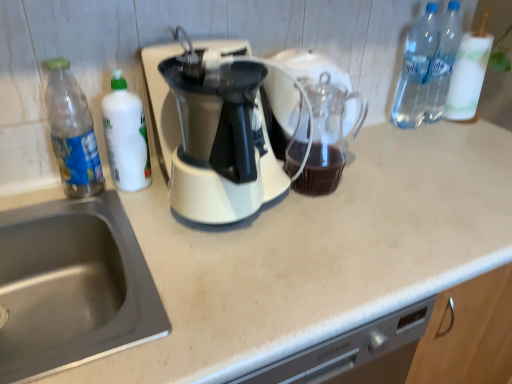
Describe the element at coordinates (319, 255) in the screenshot. The height and width of the screenshot is (384, 512). I see `beige laminate counter at center` at that location.

The image size is (512, 384). What are the coordinates of `white glossy bottle at left, positioned as the 2th bottle in left-to-right order` in the screenshot? It's located at [x=126, y=136].

Measure the distance between stainless steel sink at lower left and camera.

The distance of stainless steel sink at lower left from camera is 53.58 centimeters.

The image size is (512, 384). I want to click on transparent glass carafe at center, so click(279, 110).

In order to face transparent glass carafe at center, should I rotate leftwards or rightwards?

Turn right by 7.399 degrees to look at transparent glass carafe at center.

You are a GUI agent. You are given a task and a screenshot of the screen. Output one action in this format:
    pyautogui.click(x=<x>, y=<y>)
    Task: Click on the clear plastic bottle at upper right, the first bottle from the right
    Image resolution: width=512 pixels, height=384 pixels.
    Given the screenshot: What is the action you would take?
    pyautogui.click(x=468, y=74)

From a real-world perspective, who is located higher, white glossy bottle at left, positioned as the 2th bottle in left-to-right order, or clear plastic bottles at upper right, placed as the 2th bottle when sorted from right to left?

clear plastic bottles at upper right, placed as the 2th bottle when sorted from right to left, is physically above.

Can you confirm if white glossy bottle at left, positioned as the 2th bottle in left-to-right order, is smaller than clear plastic bottles at upper right, placed as the 2th bottle when sorted from right to left?

Yes, white glossy bottle at left, positioned as the 2th bottle in left-to-right order, is smaller than clear plastic bottles at upper right, placed as the 2th bottle when sorted from right to left.

Can we say white glossy bottle at left, positioned as the 2th bottle in left-to-right order, lies outside clear plastic bottles at upper right, placed as the 2th bottle when sorted from right to left?

white glossy bottle at left, positioned as the 2th bottle in left-to-right order, lies outside clear plastic bottles at upper right, placed as the 2th bottle when sorted from right to left,'s area.

Between white glossy bottle at left, which appears as the 3th bottle when viewed from the right, and clear plastic bottles at upper right, placed as the 2th bottle when sorted from right to left, which one appears on the left side from the viewer's perspective?

white glossy bottle at left, which appears as the 3th bottle when viewed from the right, is more to the left.

Where is `the 3rd bottle above when counting from the white glossy bottle at left, positioned as the 2th bottle in left-to-right order (from the image's perspective)`? This screenshot has width=512, height=384. the 3rd bottle above when counting from the white glossy bottle at left, positioned as the 2th bottle in left-to-right order (from the image's perspective) is located at coordinates (468, 74).

From the picture: From a real-world perspective, between white glossy bottle at left, which appears as the 3th bottle when viewed from the right, and clear plastic bottle at upper right, the 4th bottle when ordered from left to right, who is vertically lower?

white glossy bottle at left, which appears as the 3th bottle when viewed from the right, from a real-world perspective.

From the image's perspective, would you say white glossy bottle at left, which appears as the 3th bottle when viewed from the right, is positioned over clear plastic bottle at upper right, the 4th bottle when ordered from left to right?

Actually, white glossy bottle at left, which appears as the 3th bottle when viewed from the right, appears below clear plastic bottle at upper right, the 4th bottle when ordered from left to right, in the image.

From a real-world perspective, which is physically above, clear plastic bottle at upper right, the first bottle from the right, or stainless steel sink at lower left?

In real-world perspective, clear plastic bottle at upper right, the first bottle from the right, is above.

Between clear plastic bottle at upper right, the 4th bottle when ordered from left to right, and stainless steel sink at lower left, which one appears on the left side from the viewer's perspective?

stainless steel sink at lower left.

Is clear plastic bottle at upper right, the 4th bottle when ordered from left to right, wider than stainless steel sink at lower left?

In fact, clear plastic bottle at upper right, the 4th bottle when ordered from left to right, might be narrower than stainless steel sink at lower left.

Which point is more forward, (464,119) or (333,64)?

Point (333,64)

Considering the positions of objects clear plastic bottle at upper right, the first bottle from the right, and transparent glass carafe at center in the image provided, who is more to the left, clear plastic bottle at upper right, the first bottle from the right, or transparent glass carafe at center?

transparent glass carafe at center.

From the image's perspective, relative to transparent glass carafe at center, is clear plastic bottle at upper right, the 4th bottle when ordered from left to right, above or below?

Based on their image positions, clear plastic bottle at upper right, the 4th bottle when ordered from left to right, is located above transparent glass carafe at center.

From the picture: Which of these two, clear plastic bottle at upper right, the 4th bottle when ordered from left to right, or transparent glass carafe at center, is bigger?

transparent glass carafe at center.

From the image's perspective, between stainless steel sink at lower left and beige laminate counter at center, which one is located above?

stainless steel sink at lower left, from the image's perspective.

Locate an element on the screen. counter top below the stainless steel sink at lower left (from a real-world perspective) is located at coordinates (319, 255).

Which object is thinner, stainless steel sink at lower left or beige laminate counter at center?

stainless steel sink at lower left is thinner.

Is beige laminate counter at center not near clear plastic bottles at upper right, placed as the 2th bottle when sorted from right to left?

No, beige laminate counter at center is not far away from clear plastic bottles at upper right, placed as the 2th bottle when sorted from right to left.

From the image's perspective, between beige laminate counter at center and clear plastic bottles at upper right, the 3th bottle positioned from the left, which one is located above?

clear plastic bottles at upper right, the 3th bottle positioned from the left, is shown above in the image.

Is beige laminate counter at center turned away from clear plastic bottles at upper right, the 3th bottle positioned from the left?

No.

From a real-world perspective, is beige laminate counter at center physically located above or below clear plastic bottles at upper right, the 3th bottle positioned from the left?

In terms of real-world spatial position, beige laminate counter at center is below clear plastic bottles at upper right, the 3th bottle positioned from the left.

From a real-world perspective, is transparent glass carafe at center located higher than beige laminate counter at center?

Yes, from a real-world perspective, transparent glass carafe at center is over beige laminate counter at center

From the image's perspective, is transparent glass carafe at center positioned above or below beige laminate counter at center?

transparent glass carafe at center is above beige laminate counter at center.

Considering the sizes of transparent glass carafe at center and beige laminate counter at center in the image, is transparent glass carafe at center taller or shorter than beige laminate counter at center?

Considering their sizes, transparent glass carafe at center has less height than beige laminate counter at center.

From the image's perspective, count 2nd bottles upward from the white glossy bottle at left, which appears as the 3th bottle when viewed from the right, and point to it. Please provide its 2D coordinates.

[(416, 70)]

At what (x,y) coordinates should I click in order to perform the action: click on bottle that is the 2nd object to the right of the white glossy bottle at left, which appears as the 3th bottle when viewed from the right, starting at the anchor. Please return your answer as a coordinate pair (x, y). Looking at the image, I should click on (468, 74).

From the image, which object appears to be farther from stainless steel sink at lower left, transparent plastic bottle at left, which is counted as the 4th bottle, starting from the right, or beige laminate counter at center?

beige laminate counter at center.

Which object lies further to the anchor point clear plastic bottles at upper right, placed as the 2th bottle when sorted from right to left, transparent plastic bottle at left, which is counted as the 4th bottle, starting from the right, or stainless steel sink at lower left?

Based on the image, stainless steel sink at lower left appears to be further to clear plastic bottles at upper right, placed as the 2th bottle when sorted from right to left.

Based on their spatial positions, is stainless steel sink at lower left or white glossy bottle at left, positioned as the 2th bottle in left-to-right order, closer to transparent glass carafe at center?

white glossy bottle at left, positioned as the 2th bottle in left-to-right order, is positioned closer to the anchor transparent glass carafe at center.

From the picture: Estimate the real-world distances between objects in this image. Which object is closer to transparent plastic bottle at left, the first bottle from the left, white glossy bottle at left, which appears as the 3th bottle when viewed from the right, or clear plastic bottle at upper right, the first bottle from the right?

white glossy bottle at left, which appears as the 3th bottle when viewed from the right, is positioned closer to the anchor transparent plastic bottle at left, the first bottle from the left.

Estimate the real-world distances between objects in this image. Which object is further from clear plastic bottles at upper right, the 3th bottle positioned from the left, white glossy bottle at left, positioned as the 2th bottle in left-to-right order, or clear plastic bottle at upper right, the 4th bottle when ordered from left to right?

white glossy bottle at left, positioned as the 2th bottle in left-to-right order, is further to clear plastic bottles at upper right, the 3th bottle positioned from the left.

Looking at the image, which one is located closer to clear plastic bottle at upper right, the 4th bottle when ordered from left to right, white glossy bottle at left, positioned as the 2th bottle in left-to-right order, or transparent glass carafe at center?

transparent glass carafe at center is closer to clear plastic bottle at upper right, the 4th bottle when ordered from left to right.

Based on their spatial positions, is clear plastic bottle at upper right, the 4th bottle when ordered from left to right, or beige laminate counter at center further from clear plastic bottles at upper right, placed as the 2th bottle when sorted from right to left?

beige laminate counter at center is further to clear plastic bottles at upper right, placed as the 2th bottle when sorted from right to left.

From the image, which object appears to be farther from beige laminate counter at center, transparent glass carafe at center or clear plastic bottles at upper right, the 3th bottle positioned from the left?

clear plastic bottles at upper right, the 3th bottle positioned from the left, is further to beige laminate counter at center.

Where is `coffeepot between transparent plastic bottle at left, which is counted as the 4th bottle, starting from the right, and clear plastic bottles at upper right, placed as the 2th bottle when sorted from right to left, from left to right`? coffeepot between transparent plastic bottle at left, which is counted as the 4th bottle, starting from the right, and clear plastic bottles at upper right, placed as the 2th bottle when sorted from right to left, from left to right is located at coordinates (279, 110).

Locate an element on the screen. coffeepot between white glossy bottle at left, positioned as the 2th bottle in left-to-right order, and clear plastic bottle at upper right, the first bottle from the right, from left to right is located at coordinates (279, 110).

You are a GUI agent. You are given a task and a screenshot of the screen. Output one action in this format:
    pyautogui.click(x=<x>, y=<y>)
    Task: Click on the coffeepot between clear plastic bottle at upper right, the 4th bottle when ordered from left to right, and beige laminate counter at center in the up-down direction
    The width and height of the screenshot is (512, 384).
    Given the screenshot: What is the action you would take?
    pyautogui.click(x=279, y=110)

This screenshot has width=512, height=384. I want to click on bottle between transparent plastic bottle at left, which is counted as the 4th bottle, starting from the right, and stainless steel sink at lower left from top to bottom, so click(126, 136).